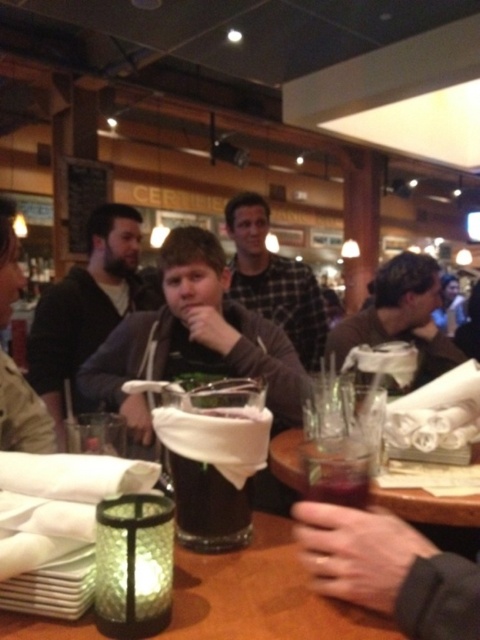
Question: Does plaid flannel shirt at center have a lesser width compared to matte black jacket at center?

Choices:
 (A) no
 (B) yes

Answer: (A)

Question: Estimate the real-world distances between objects in this image. Which object is closer to the translucent glass at center?

Choices:
 (A) matte black jacket at center
 (B) dark gray sweater at center
 (C) plaid flannel shirt at center
 (D) matte brown shirt at center

Answer: (A)

Question: Can you confirm if dark gray sweater at center is wider than matte black jacket at center?

Choices:
 (A) yes
 (B) no

Answer: (A)

Question: Which point is closer to the camera taking this photo?

Choices:
 (A) (317, 298)
 (B) (72, 328)
 (C) (420, 264)

Answer: (C)

Question: Based on their relative distances, which object is nearer to the translucent glass at center?

Choices:
 (A) dark gray sweater at center
 (B) matte black jacket at center

Answer: (B)

Question: Can you confirm if dark gray sweater at center is thinner than matte black jacket at center?

Choices:
 (A) no
 (B) yes

Answer: (A)